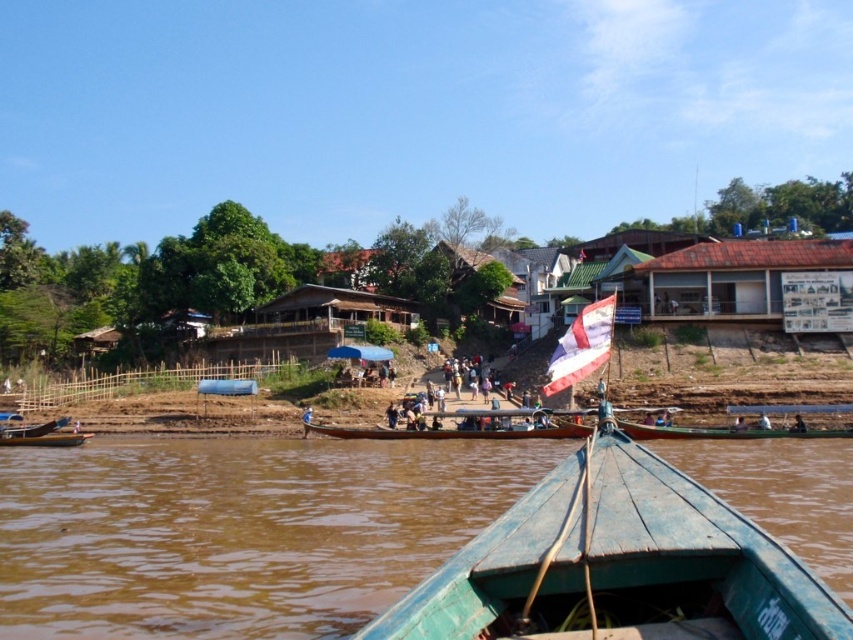
Question: In this image, where is wooden hut at center located relative to brown leather bag at lower right?

Choices:
 (A) below
 (B) above

Answer: (B)

Question: Does wooden canoe at center appear over brown leather bag at lower right?

Choices:
 (A) yes
 (B) no

Answer: (B)

Question: Considering the real-world distances, which object is farthest from the striped fabric flag at center?

Choices:
 (A) brown leather jacket at lower center
 (B) wooden houses at center
 (C) brown wooden boat at center

Answer: (B)

Question: Among these objects, which one is farthest from the camera?

Choices:
 (A) brown leather bag at lower right
 (B) brown wooden boat at center
 (C) wooden canoe at center

Answer: (C)

Question: Does wooden houses at center have a smaller size compared to brown corrugated metal hut at upper right?

Choices:
 (A) yes
 (B) no

Answer: (B)

Question: Estimate the real-world distances between objects in this image. Which object is closer to the brown leather bag at lower right?

Choices:
 (A) brown wooden boat at center
 (B) brown leather jacket at lower center

Answer: (B)